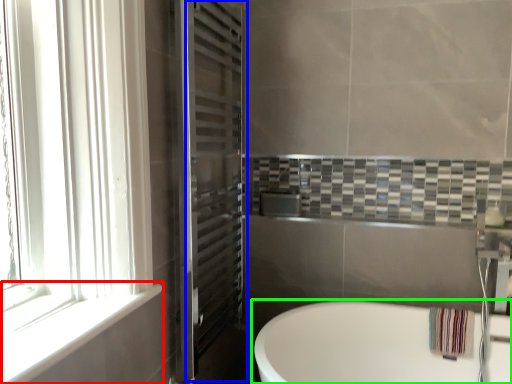
Question: Based on their relative distances, which object is farther from window sill (highlighted by a red box)? Choose from screen door (highlighted by a blue box) and bathtub (highlighted by a green box).

Choices:
 (A) screen door
 (B) bathtub

Answer: (B)